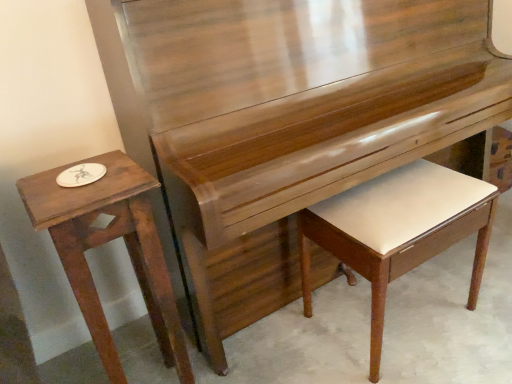
Question: Is white leather music stool at lower right wider or thinner than wooden table at left?

Choices:
 (A) wide
 (B) thin

Answer: (A)

Question: Considering their positions, is white leather music stool at lower right located in front of or behind wooden table at left?

Choices:
 (A) front
 (B) behind

Answer: (B)

Question: Considering the positions of white leather music stool at lower right and wooden table at left in the image, is white leather music stool at lower right bigger or smaller than wooden table at left?

Choices:
 (A) small
 (B) big

Answer: (B)

Question: From a real-world perspective, is wooden table at left positioned above or below white leather music stool at lower right?

Choices:
 (A) above
 (B) below

Answer: (A)

Question: Do you think wooden table at left is within white leather music stool at lower right, or outside of it?

Choices:
 (A) inside
 (B) outside

Answer: (B)

Question: Is point (158, 309) positioned closer to the camera than point (485, 200)?

Choices:
 (A) farther
 (B) closer

Answer: (B)

Question: Looking at their shapes, would you say wooden table at left is wider or thinner than white leather music stool at lower right?

Choices:
 (A) wide
 (B) thin

Answer: (B)